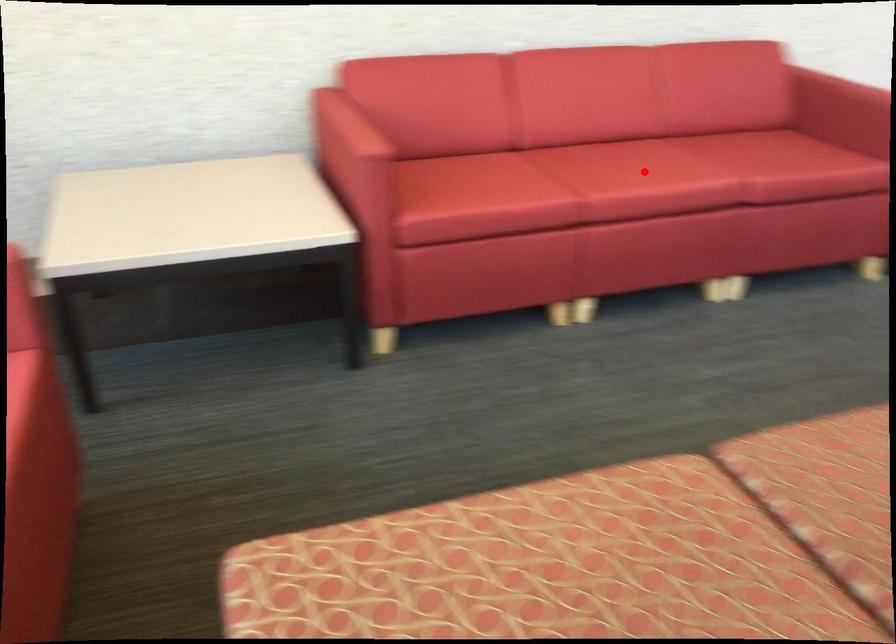
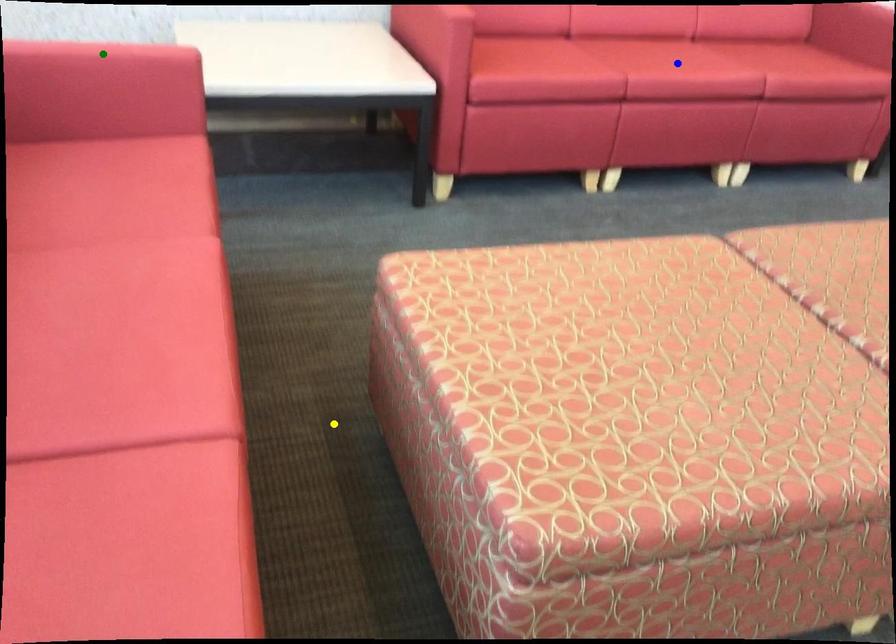
Question: I am providing you with two images of the same scene from different viewpoints. A red point is marked on the first image. You are given multiple points on the second image. Which point in image 2 is actually the same real-world point as the red point in image 1?

Choices:
 (A) blue point
 (B) green point
 (C) yellow point

Answer: (A)